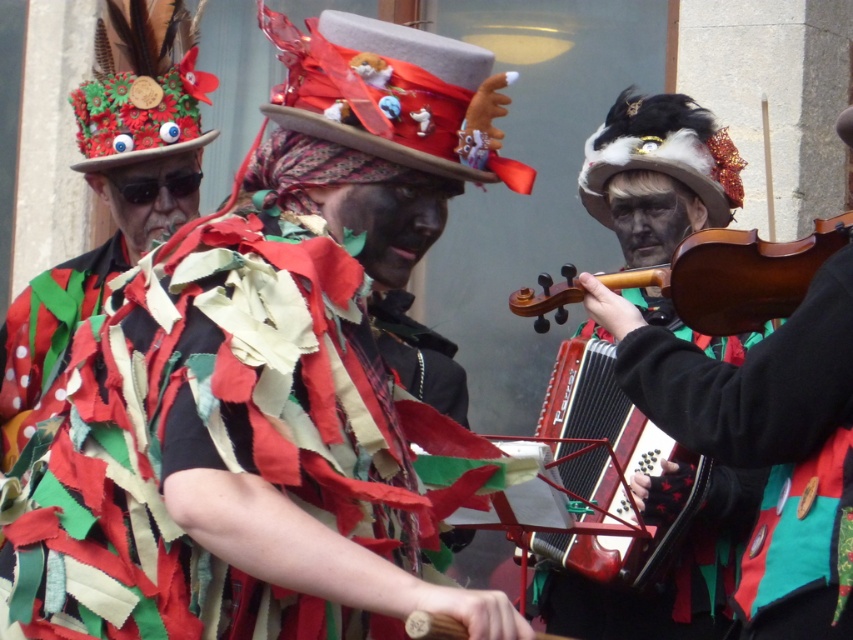
Based on the photo, you are a photographer trying to capture the central performer. You notice the multicolored fabric strips at center and the wooden accordion at center. Which object should you focus on to ensure the central performer is in focus?

The multicolored fabric strips at center is in front of the wooden accordion at center, so focusing on the multicolored fabric strips at center will ensure the central performer is in focus.

You are a photographer trying to capture the perfect shot of the street performance. You want to focus on the multicolored fabric strips at center. Based on their position, where should you aim your camera?

The multicolored fabric strips at center are located at coordinates point 0.616 on the x axis and 0.314 on the y axis, so you should aim your camera at that specific point to capture them.

You are a street performer who wants to place your wooden accordion at center and brown wooden violin at center on a narrow shelf that can only fit one instrument at a time. Which instrument should you place first to ensure the other can be placed afterward?

The wooden accordion at center is to the left of brown wooden violin at center, so you should place the brown wooden violin at center first, then the wooden accordion at center can be placed afterward since it is positioned to the left.